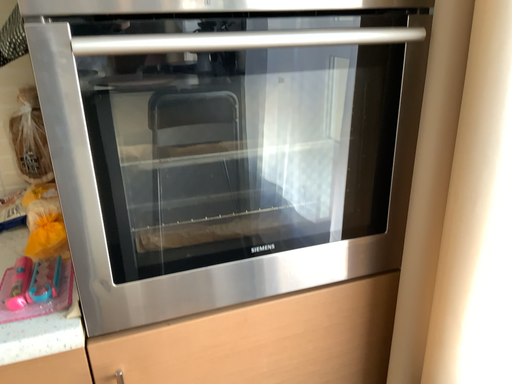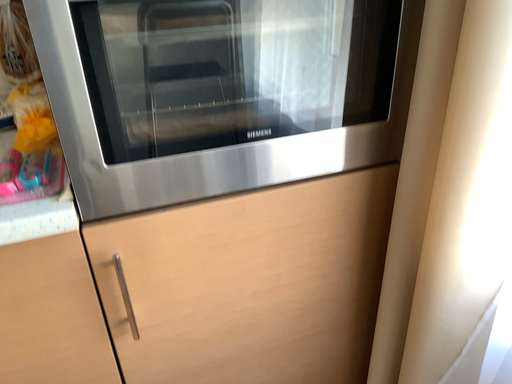
Question: How did the camera likely rotate when shooting the video?

Choices:
 (A) rotated downward
 (B) rotated upward

Answer: (A)